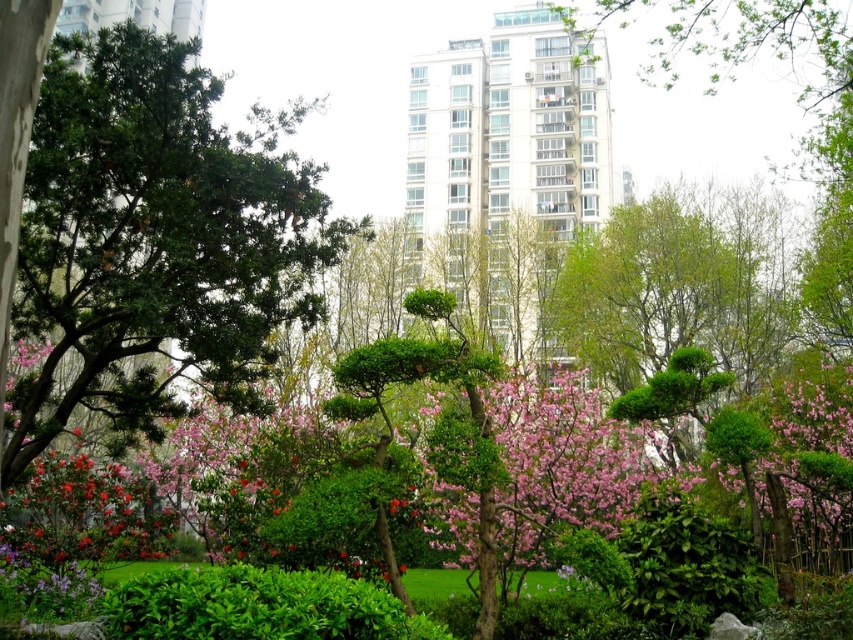
From the picture: Can you confirm if green needle-like at left is positioned below pink bloom at center?

No, green needle-like at left is not below pink bloom at center.

Between green needle-like at left and pink bloom at center, which one is positioned higher?

green needle-like at left is higher up.

This screenshot has width=853, height=640. What do you see at coordinates (154, 241) in the screenshot?
I see `green needle-like at left` at bounding box center [154, 241].

Where is `green needle-like at left`? The image size is (853, 640). green needle-like at left is located at coordinates (154, 241).

Does pink bloom at center have a greater height compared to green leafy bush at lower center?

Correct, pink bloom at center is much taller as green leafy bush at lower center.

Is pink bloom at center above green leafy bush at lower center?

Correct, pink bloom at center is located above green leafy bush at lower center.

Who is more forward, (576, 467) or (247, 616)?

Point (247, 616)

The image size is (853, 640). I want to click on pink bloom at center, so click(563, 461).

Does point (215, 362) lie behind point (260, 630)?

Yes, point (215, 362) is farther from viewer.

Is green needle-like at left shorter than green leafy bush at lower center?

In fact, green needle-like at left may be taller than green leafy bush at lower center.

Which is behind, point (0, 483) or point (321, 605)?

Positioned behind is point (0, 483).

Image resolution: width=853 pixels, height=640 pixels. Find the location of `green needle-like at left`. green needle-like at left is located at coordinates (154, 241).